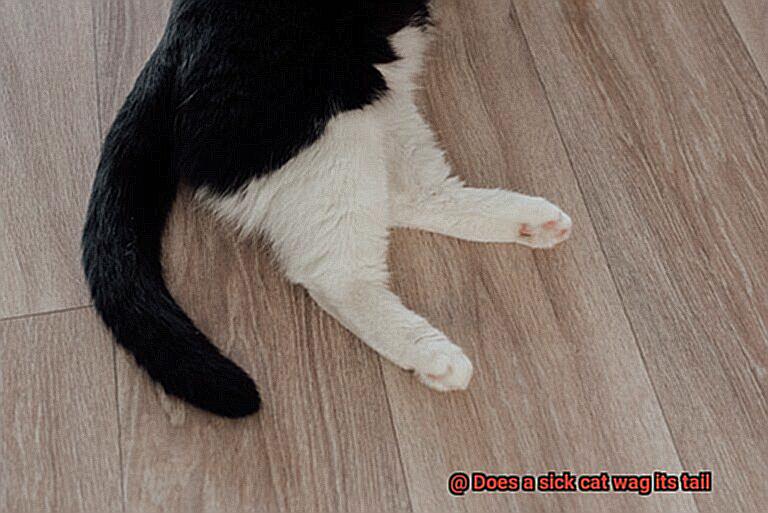
Identify the location of white fur. This screenshot has width=768, height=513. (318, 201), (425, 157).